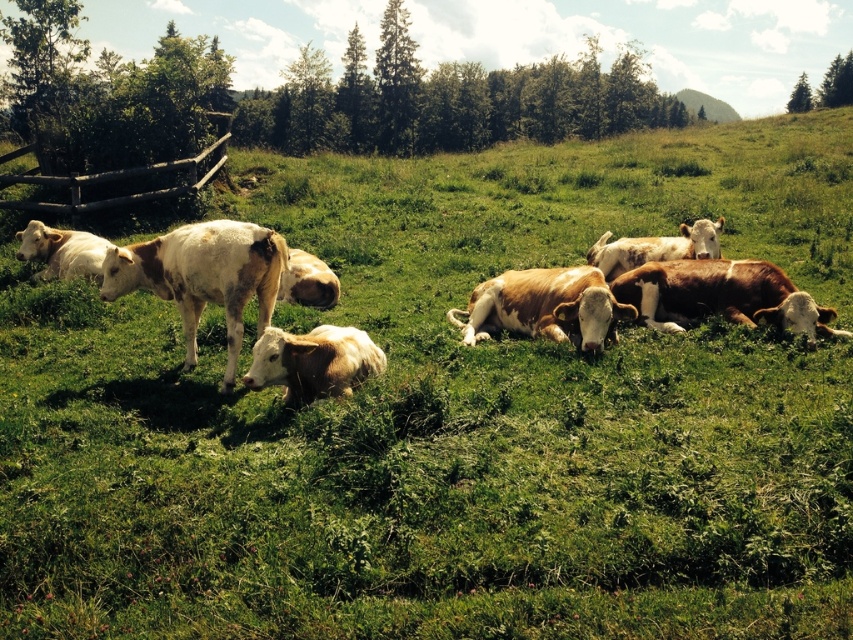
Is brown speckled cow at center below brown wooden fence at left?

Indeed, brown speckled cow at center is positioned under brown wooden fence at left.

Between point (244, 269) and point (224, 138), which one is positioned in front?

Point (244, 269)

I want to click on brown speckled cow at center, so click(132, 264).